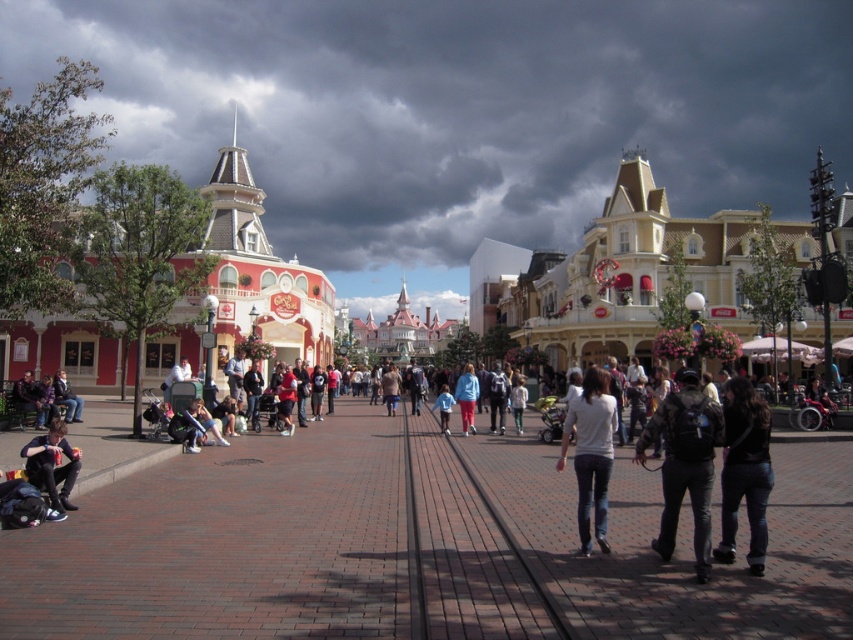
Consider the image. You are a theme park visitor trying to decide which item to wear for comfort. You have a black leather jacket at center and a blue fabric shirt at center. Which one is bigger in size?

The black leather jacket at center has a larger size compared to the blue fabric shirt at center, so the black leather jacket at center is bigger.